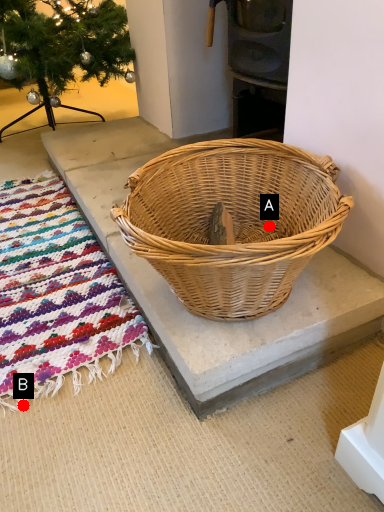
Question: Two points are circled on the image, labeled by A and B beside each circle. Which point appears farthest from the camera in this image?

Choices:
 (A) A is further
 (B) B is further

Answer: (A)